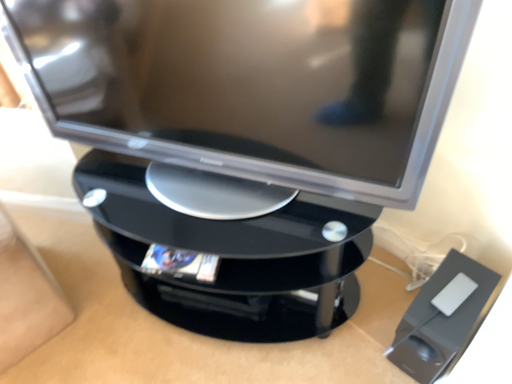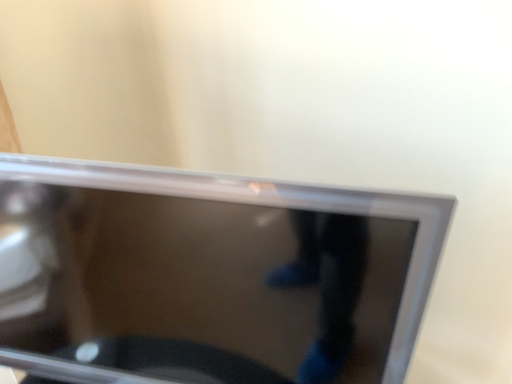
Question: Which way did the camera rotate in the video?

Choices:
 (A) rotated upward
 (B) rotated downward

Answer: (A)